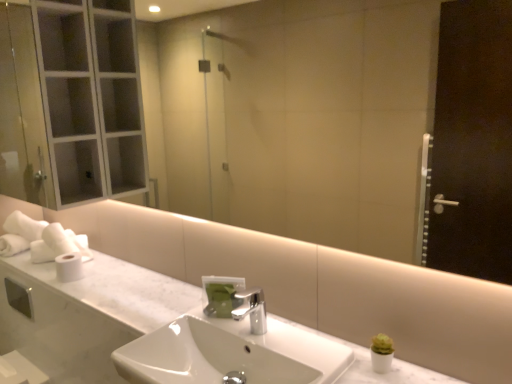
Where is `vacant space behind white matte toilet paper at left, which ranks as the 1th toilet paper in front-to-back order`? The width and height of the screenshot is (512, 384). vacant space behind white matte toilet paper at left, which ranks as the 1th toilet paper in front-to-back order is located at coordinates (91, 260).